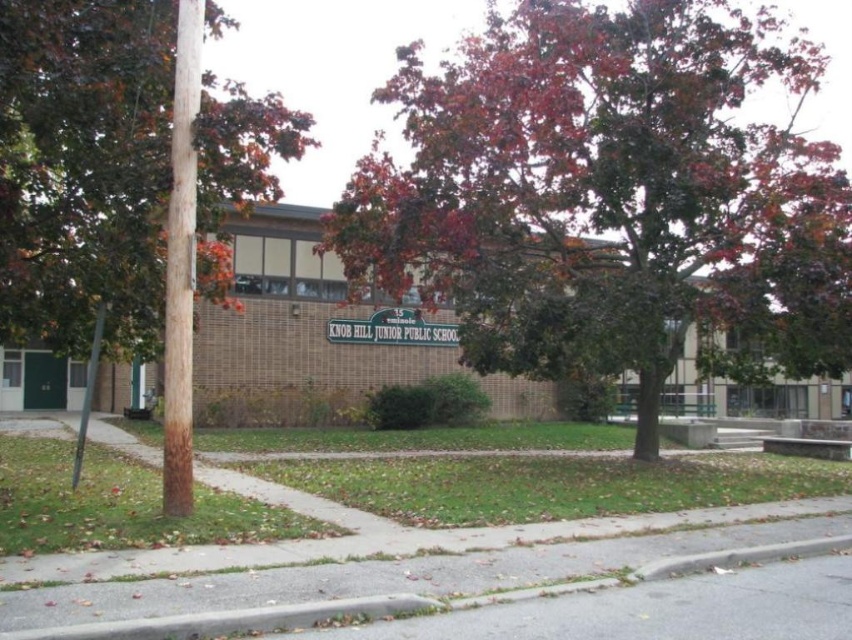
You are a student walking on the sidewalk towards the school entrance. From your perspective, which object is closer to you, the autumn leaves at center or the metallic pole at left?

The autumn leaves at center are closer to you because the metallic pole at left is behind them.

You are a student carrying a heavy backpack and need to walk from the brown textured pole at left to the school entrance. The autumn leaves at center are in your path. Is there enough space to walk around the leaves without stepping on them?

The distance between the brown textured pole at left and autumn leaves at center is 7.46 meters, so there is sufficient space to walk around the leaves without stepping on them.

You are a student trying to reach the school entrance from the sidewalk. The metallic pole at left is blocking your path. Can you walk around it to reach the autumn leaves at center without getting too close to the pole?

The distance between the autumn leaves at center and metallic pole at left is 12.53 meters, so you can safely walk around the metallic pole at left to reach the autumn leaves at center while maintaining a safe distance.